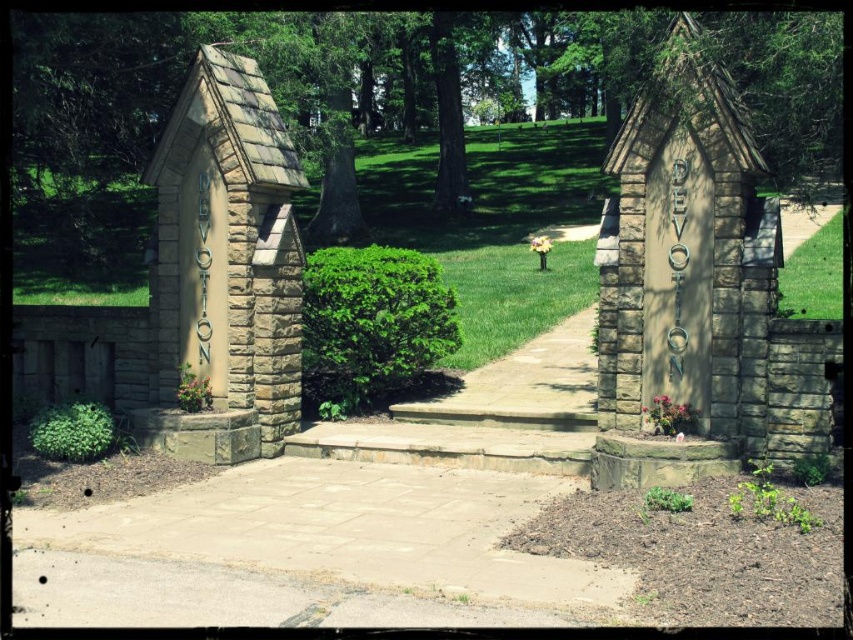
Question: Observing the image, what is the correct spatial positioning of stone textured hut at left in reference to green leafy hedge at lower left?

Choices:
 (A) right
 (B) left

Answer: (A)

Question: Among these objects, which one is nearest to the camera?

Choices:
 (A) green leafy bush at center
 (B) stone textured hut at left

Answer: (B)

Question: Which object is positioned closest to the green leafy bush at center?

Choices:
 (A) green leafy hedge at lower left
 (B) stone/rough textured chapel at right

Answer: (A)

Question: In this image, where is stone/rough textured chapel at right located relative to green leafy bush at center?

Choices:
 (A) above
 (B) below

Answer: (A)

Question: Can you confirm if smooth stone path at center is positioned above stone textured hut at left?

Choices:
 (A) no
 (B) yes

Answer: (A)

Question: Considering the real-world distances, which object is closest to the green leafy bush at center?

Choices:
 (A) stone textured hut at left
 (B) green leafy hedge at lower left
 (C) stone/rough textured chapel at right
 (D) smooth stone path at center

Answer: (A)